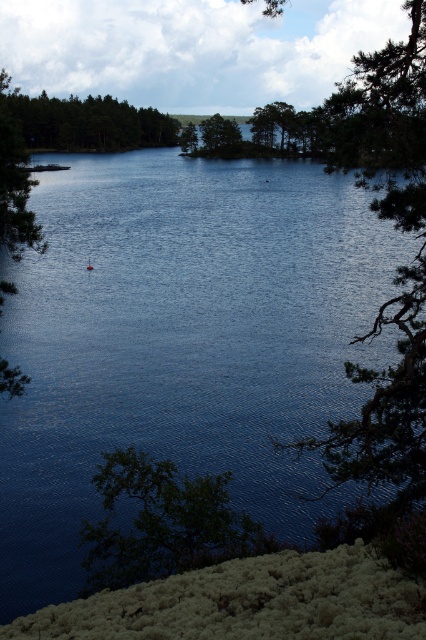
You are standing at the lakeside and see two points marked on the water surface. The first point is at coordinates point (103, 467) and the second is at point (100, 104). Which point is closer to your current position?

Point (103, 467) is closer to the viewer than point (100, 104), so the first point is closer to your current position.

Consider the image. You are standing at the lakeside and notice two green matte trees in the scene. Which one, the green matte tree at upper left or the green matte tree at center, is closer to you?

The green matte tree at upper left is closer to you because it is in front of the green matte tree at center.

You are a bird flying over the serene lakeside scene. You want to land on the tallest tree to rest. Which tree should you choose between the green matte tree at upper left and the green matte tree at center?

The green matte tree at upper left is taller than the green matte tree at center, so you should choose the green matte tree at upper left to rest.